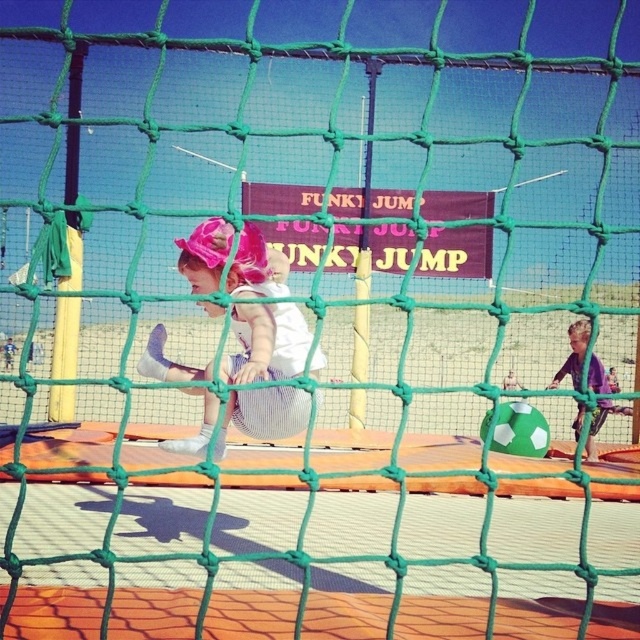
Question: Does pink fabric hat at upper left have a smaller size compared to purple matte shirt at right?

Choices:
 (A) yes
 (B) no

Answer: (B)

Question: Which point is farther from the camera taking this photo?

Choices:
 (A) (288, 406)
 (B) (577, 426)

Answer: (B)

Question: Does pink fabric hat at upper left have a lesser width compared to purple matte shirt at right?

Choices:
 (A) no
 (B) yes

Answer: (A)

Question: Which of the following is the farthest from the observer?

Choices:
 (A) purple matte shirt at right
 (B) pink fabric hat at upper left

Answer: (A)

Question: Is pink fabric hat at upper left thinner than purple matte shirt at right?

Choices:
 (A) no
 (B) yes

Answer: (A)